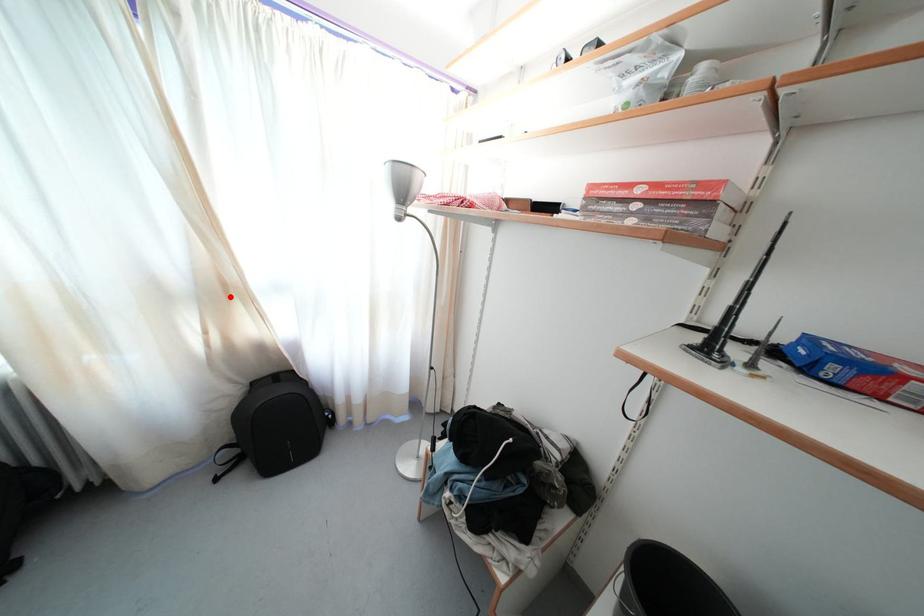
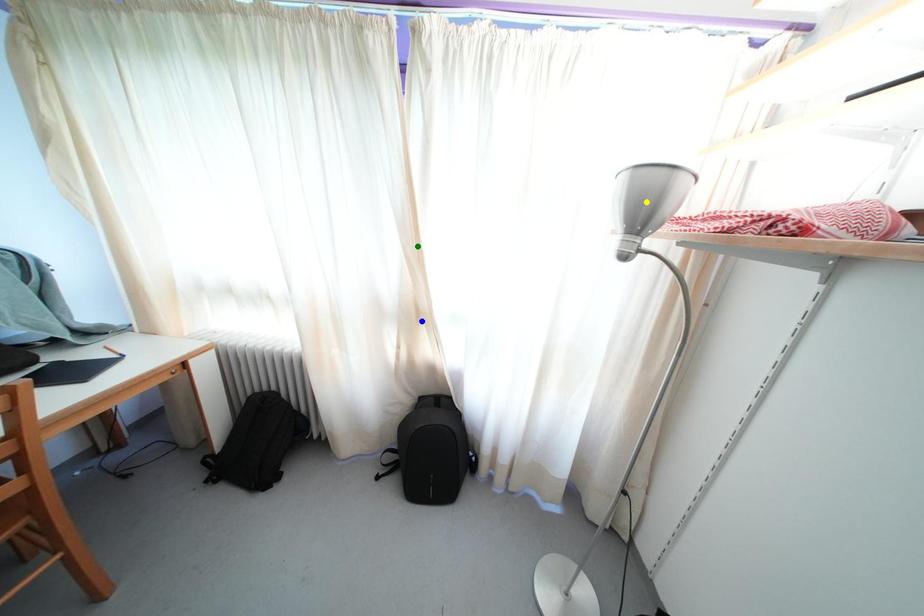
Question: I am providing you with two images of the same scene from different viewpoints. A red point is marked on the first image. You are given multiple points on the second image. Which point in image 2 is actually the same real-world point as the red point in image 1?

Choices:
 (A) green point
 (B) yellow point
 (C) blue point

Answer: (C)